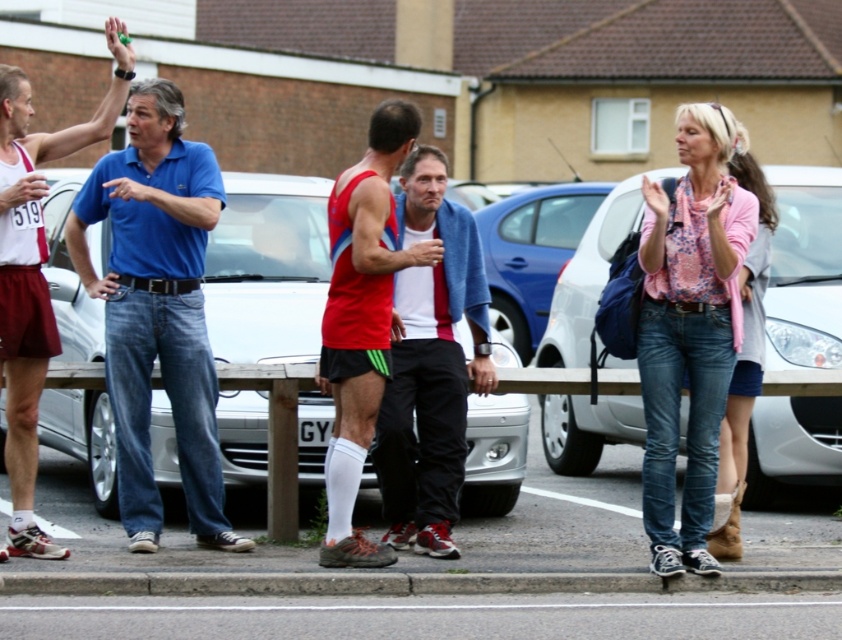
Does silver metallic car at center lie in front of blue metallic car at center?

Yes.

Does silver metallic car at center have a larger size compared to blue metallic car at center?

Actually, silver metallic car at center might be smaller than blue metallic car at center.

Which is behind, point (51, 392) or point (498, 237)?

Point (498, 237)

I want to click on silver metallic car at center, so click(267, 268).

You are a GUI agent. You are given a task and a screenshot of the screen. Output one action in this format:
    pyautogui.click(x=<x>, y=<y>)
    Task: Click on the matte blue polo shirt at left
    
    Given the screenshot: What is the action you would take?
    pyautogui.click(x=35, y=272)

Who is more forward, [13,208] or [760,385]?

Point [13,208]

This screenshot has width=842, height=640. I want to click on matte blue polo shirt at left, so click(35, 272).

Find the location of `metallic silver car at right`. metallic silver car at right is located at coordinates (805, 268).

Does metallic silver car at right have a greater width compared to pink floral blouse at center?

Incorrect, metallic silver car at right's width does not surpass pink floral blouse at center's.

Is point (802, 344) behind point (653, 234)?

Yes, it is.

Image resolution: width=842 pixels, height=640 pixels. I want to click on metallic silver car at right, so click(805, 268).